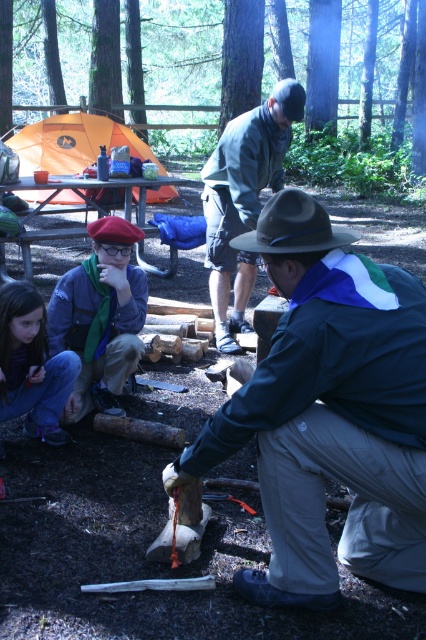
Question: Where is dark blue uniform at center located in relation to matte blue shirt at center in the image?

Choices:
 (A) left
 (B) right

Answer: (B)

Question: Which point is closer to the camera taking this photo?

Choices:
 (A) (45, 372)
 (B) (247, 282)
 (C) (77, 269)

Answer: (A)

Question: Which is farther from the gray fabric jacket at center?

Choices:
 (A) matte green scarf at lower left
 (B) orange fabric tent at upper left

Answer: (B)

Question: Does gray fabric jacket at center have a smaller size compared to matte green scarf at lower left?

Choices:
 (A) no
 (B) yes

Answer: (A)

Question: Observing the image, what is the correct spatial positioning of matte blue shirt at center in reference to matte green scarf at lower left?

Choices:
 (A) right
 (B) left

Answer: (A)

Question: Among these objects, which one is farthest from the camera?

Choices:
 (A) orange fabric tent at upper left
 (B) dark blue uniform at center
 (C) gray fabric jacket at center

Answer: (A)